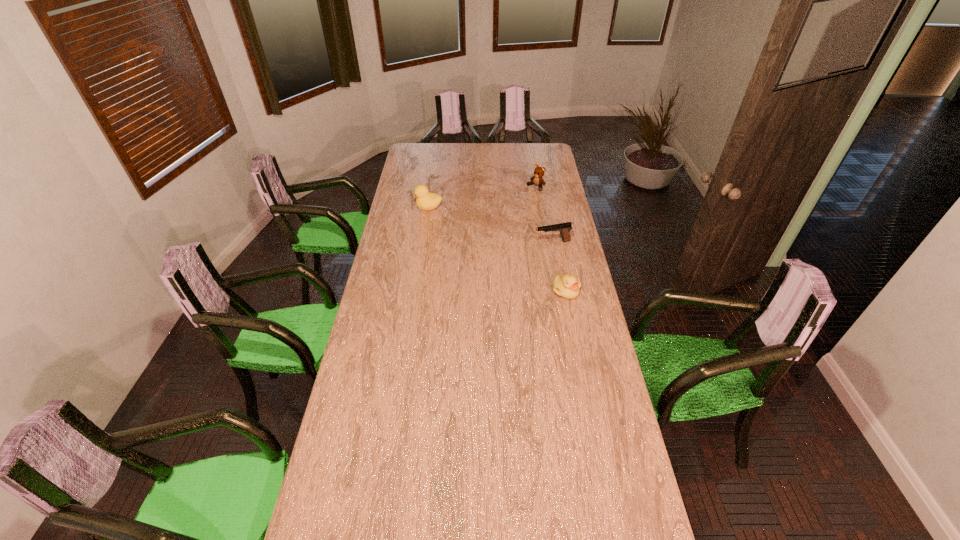
I want to click on vacant space at the left edge, so click(x=376, y=294).

Find the location of a particular element. This screenshot has width=960, height=540. vacant region at the right edge is located at coordinates (598, 412).

The width and height of the screenshot is (960, 540). In the image, there is a desktop. Identify the location of vacant space at the far right corner. (551, 160).

Where is `free area in between the nearest object and the leftmost object`? The image size is (960, 540). free area in between the nearest object and the leftmost object is located at coordinates pos(497,249).

You are a GUI agent. You are given a task and a screenshot of the screen. Output one action in this format:
    pyautogui.click(x=<x>, y=<y>)
    Task: Click on the vacant region between the leftmost object and the teddy bear
    This screenshot has height=540, width=960.
    Given the screenshot: What is the action you would take?
    pyautogui.click(x=482, y=197)

Find the location of `free space between the leftmost object and the shortest object`. free space between the leftmost object and the shortest object is located at coordinates (497, 249).

Identify the location of vacant point located between the duck and the third farthest object. (491, 226).

At what (x,y) coordinates should I click in order to perform the action: click on vacant area between the second farthest object and the nearest object. Please return your answer as a coordinate pair (x, y). Image resolution: width=960 pixels, height=540 pixels. Looking at the image, I should click on (497, 249).

Identify the location of vacant region between the shortest object and the teddy bear. The image size is (960, 540). (551, 239).

Where is `vacant area that lies between the third nearest object and the duckling`? The width and height of the screenshot is (960, 540). vacant area that lies between the third nearest object and the duckling is located at coordinates [497, 249].